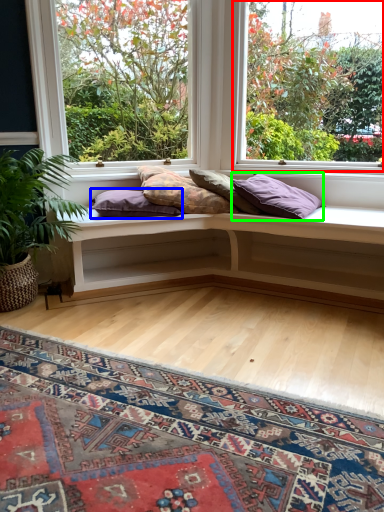
Question: Based on their relative distances, which object is farther from window (highlighted by a red box)? Choose from pillow (highlighted by a blue box) and pillow (highlighted by a green box).

Choices:
 (A) pillow
 (B) pillow

Answer: (A)